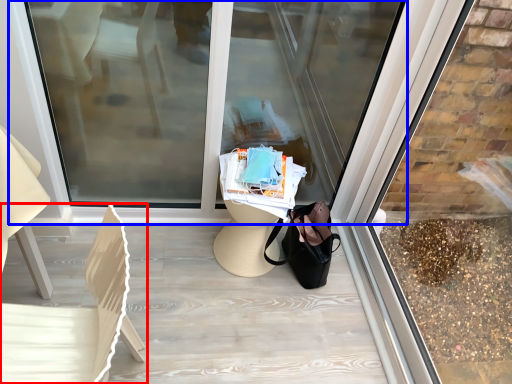
Question: Which object is closer to the camera taking this photo, chair (highlighted by a red box) or shop window (highlighted by a blue box)?

Choices:
 (A) chair
 (B) shop window

Answer: (A)